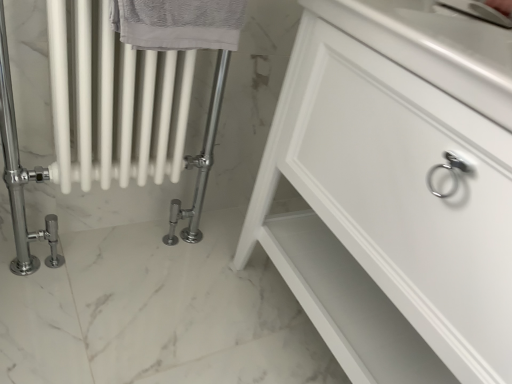
Question: Is white glossy cabinet at center at the left side of white glossy radiator at left?

Choices:
 (A) yes
 (B) no

Answer: (B)

Question: Would you say white glossy cabinet at center is a long distance from white glossy radiator at left?

Choices:
 (A) no
 (B) yes

Answer: (A)

Question: Is white glossy cabinet at center smaller than white glossy radiator at left?

Choices:
 (A) yes
 (B) no

Answer: (B)

Question: Is white glossy cabinet at center located outside white glossy radiator at left?

Choices:
 (A) yes
 (B) no

Answer: (A)

Question: Can you confirm if white glossy cabinet at center is bigger than white glossy radiator at left?

Choices:
 (A) no
 (B) yes

Answer: (B)

Question: Is white glossy cabinet at center situated inside gray textured towel at upper left or outside?

Choices:
 (A) outside
 (B) inside

Answer: (A)

Question: In terms of width, does white glossy cabinet at center look wider or thinner when compared to gray textured towel at upper left?

Choices:
 (A) thin
 (B) wide

Answer: (B)

Question: Is point (497, 286) closer or farther from the camera than point (207, 13)?

Choices:
 (A) closer
 (B) farther

Answer: (A)

Question: Considering the relative positions of white glossy cabinet at center and gray textured towel at upper left in the image provided, is white glossy cabinet at center to the left or to the right of gray textured towel at upper left?

Choices:
 (A) left
 (B) right

Answer: (B)

Question: From the image's perspective, is white glossy radiator at left positioned above or below white glossy cabinet at center?

Choices:
 (A) below
 (B) above

Answer: (B)

Question: Considering the positions of white glossy radiator at left and white glossy cabinet at center in the image, is white glossy radiator at left bigger or smaller than white glossy cabinet at center?

Choices:
 (A) big
 (B) small

Answer: (B)

Question: From a real-world perspective, is white glossy radiator at left positioned above or below white glossy cabinet at center?

Choices:
 (A) below
 (B) above

Answer: (A)

Question: Is white glossy radiator at left in front of or behind white glossy cabinet at center in the image?

Choices:
 (A) front
 (B) behind

Answer: (B)

Question: Would you say gray textured towel at upper left is to the left or to the right of white glossy radiator at left in the picture?

Choices:
 (A) right
 (B) left

Answer: (A)

Question: In the image, is gray textured towel at upper left positioned in front of or behind white glossy radiator at left?

Choices:
 (A) behind
 (B) front

Answer: (B)